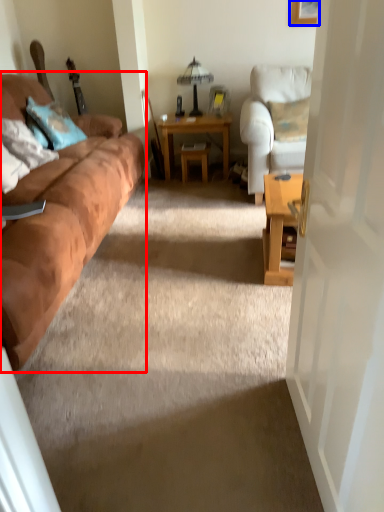
Question: Which point is closer to the camera, studio couch (highlighted by a red box) or picture frame (highlighted by a blue box)?

Choices:
 (A) studio couch
 (B) picture frame

Answer: (A)